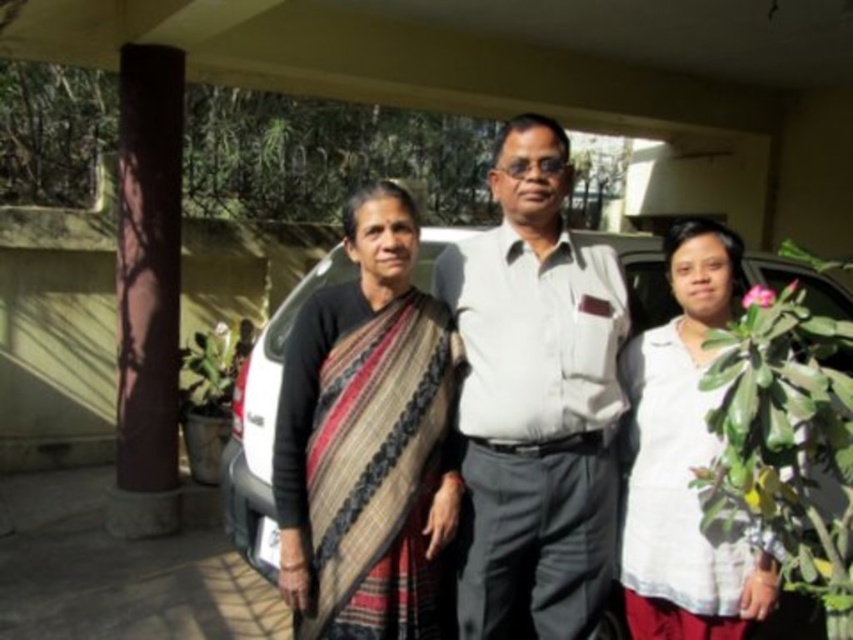
Which is more to the left, white smooth shirt at center or white matte car at center?

white matte car at center

From the picture: Does white smooth shirt at center have a greater height compared to white matte car at center?

Correct, white smooth shirt at center is much taller as white matte car at center.

The image size is (853, 640). What are the coordinates of `white smooth shirt at center` in the screenshot? It's located at (535, 400).

Is white cotton shirt at center above white matte car at center?

No, white cotton shirt at center is not above white matte car at center.

Does white cotton shirt at center have a greater width compared to white matte car at center?

Incorrect, white cotton shirt at center's width does not surpass white matte car at center's.

Describe the element at coordinates (683, 460) in the screenshot. I see `white cotton shirt at center` at that location.

Identify the location of white cotton shirt at center. This screenshot has height=640, width=853. (683, 460).

Does point (405, 547) come farther from viewer compared to point (648, 420)?

No, it is not.

Between point (408, 278) and point (679, 323), which one is positioned behind?

The point (679, 323) is more distant.

Locate an element on the screen. The width and height of the screenshot is (853, 640). striped fabric saree at center is located at coordinates 366,440.